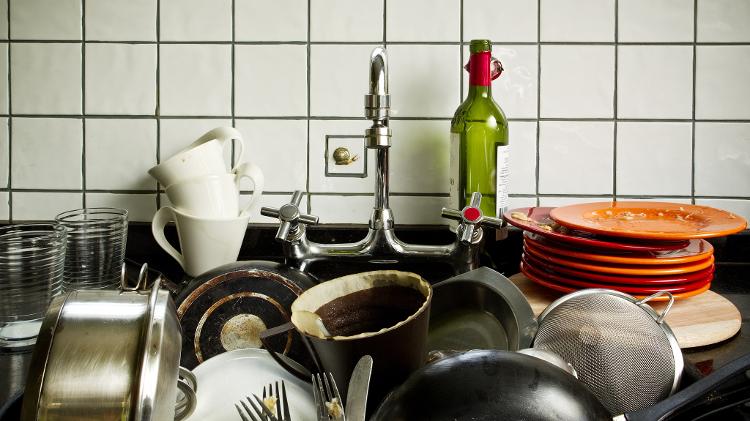
What are the coordinates of `utensils` in the screenshot? It's located at (268, 418), (282, 400), (326, 393), (360, 386).